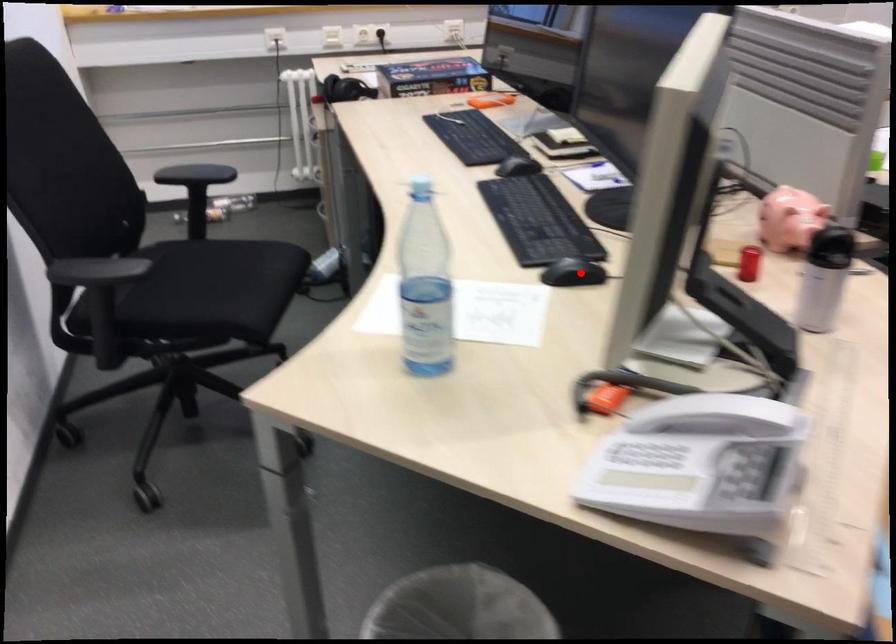
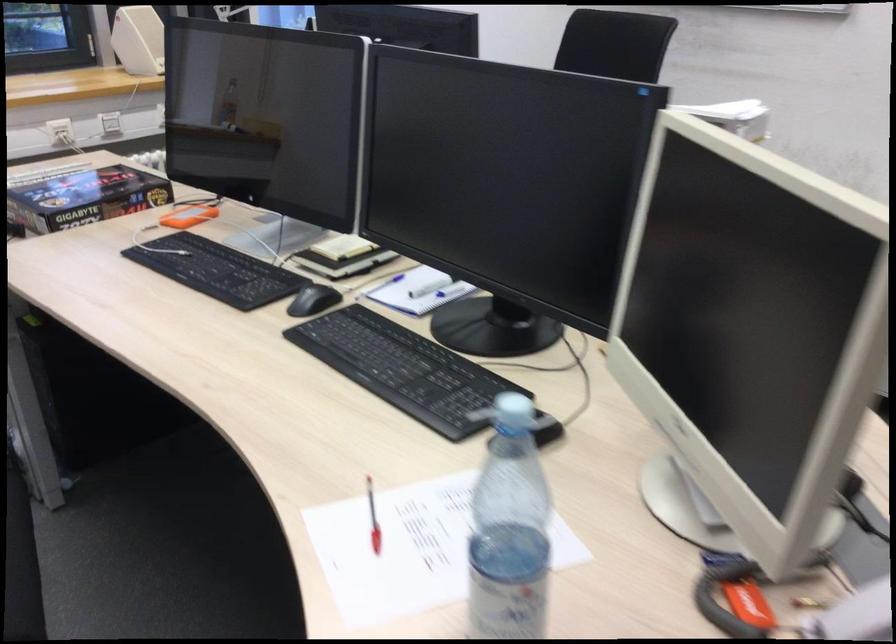
Where in the second image is the point corresponding to the highlighted location from the first image?

(547, 431)